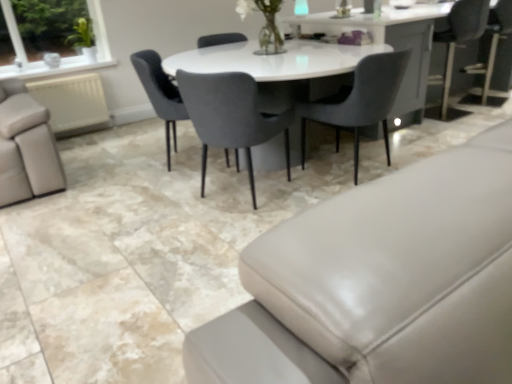
Image resolution: width=512 pixels, height=384 pixels. What are the coordinates of `vacant space situated on the left part of matte gray chair at center, which appears as the first chair when viewed from the left` in the screenshot? It's located at (115, 162).